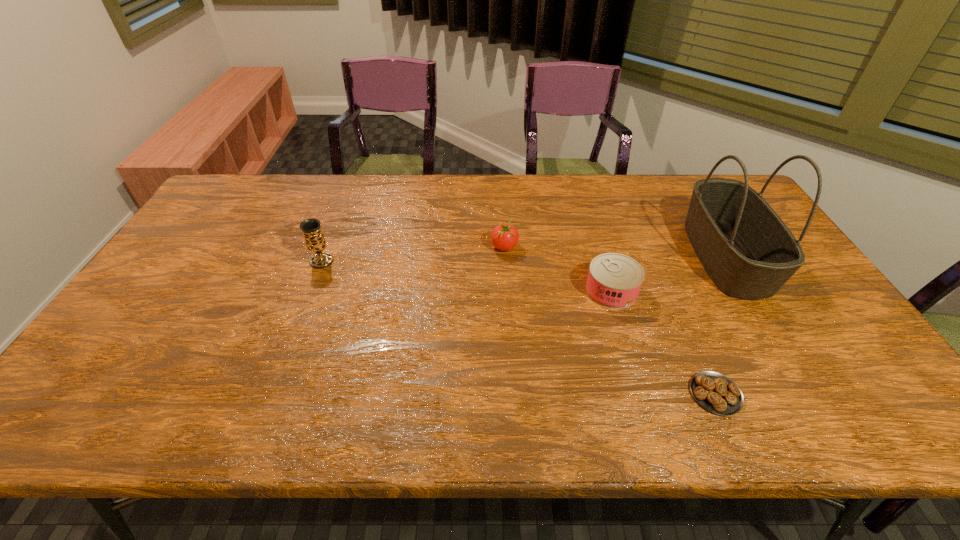
I want to click on empty space between the basket and the third object from left to right, so click(668, 273).

At what (x,y) coordinates should I click in order to perform the action: click on free space between the tomato and the third object from right to left. Please return your answer as a coordinate pair (x, y). Image resolution: width=960 pixels, height=540 pixels. Looking at the image, I should click on (558, 268).

The width and height of the screenshot is (960, 540). In order to click on vacant space that is in between the can and the tomato in this screenshot , I will do `click(558, 268)`.

I want to click on free space between the leftmost object and the can, so click(x=467, y=276).

Locate an element on the screen. blank region between the can and the chalice is located at coordinates (467, 276).

You are a GUI agent. You are given a task and a screenshot of the screen. Output one action in this format:
    pyautogui.click(x=<x>, y=<y>)
    Task: Click on the vacant space that is in between the leftmost object and the nearest object
    
    Given the screenshot: What is the action you would take?
    pyautogui.click(x=518, y=328)

You are a GUI agent. You are given a task and a screenshot of the screen. Output one action in this format:
    pyautogui.click(x=<x>, y=<y>)
    Task: Click on the vacant space that's between the pastry and the fourth object from right to left
    The width and height of the screenshot is (960, 540).
    Given the screenshot: What is the action you would take?
    pyautogui.click(x=610, y=320)

Locate an element on the screen. This screenshot has height=540, width=960. free spot between the chalice and the tomato is located at coordinates (413, 254).

Find the location of `vacant area that lies between the tomato and the fourth object from left to right`. vacant area that lies between the tomato and the fourth object from left to right is located at coordinates (610, 320).

What are the coordinates of `vacant point located between the tomato and the chalice` in the screenshot? It's located at (413, 254).